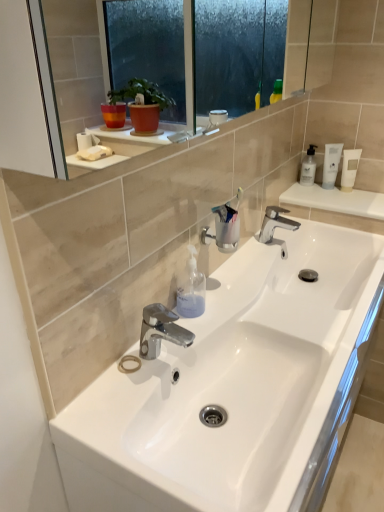
Question: Is clear plastic cup at center next to chrome metallic faucet at center, the second tap in the top-to-bottom sequence?

Choices:
 (A) yes
 (B) no

Answer: (B)

Question: Is clear plastic cup at center positioned beyond the bounds of chrome metallic faucet at center, placed as the first tap when sorted from front to back?

Choices:
 (A) yes
 (B) no

Answer: (A)

Question: Is clear plastic cup at center far from chrome metallic faucet at center, which is counted as the first tap, starting from the bottom?

Choices:
 (A) yes
 (B) no

Answer: (B)

Question: From the image's perspective, is clear plastic cup at center below chrome metallic faucet at center, placed as the first tap when sorted from front to back?

Choices:
 (A) no
 (B) yes

Answer: (A)

Question: Considering the relative positions of clear plastic cup at center and chrome metallic faucet at center, positioned as the 1th tap in left-to-right order, in the image provided, is clear plastic cup at center to the right of chrome metallic faucet at center, positioned as the 1th tap in left-to-right order, from the viewer's perspective?

Choices:
 (A) yes
 (B) no

Answer: (A)

Question: From a real-world perspective, is clear plastic cup at center positioned under chrome metallic faucet at center, the second tap in the top-to-bottom sequence, based on gravity?

Choices:
 (A) yes
 (B) no

Answer: (B)

Question: Is clear plastic cup at center oriented away from white matte bottle at upper right?

Choices:
 (A) yes
 (B) no

Answer: (B)

Question: Does clear plastic cup at center have a lesser height compared to white matte bottle at upper right?

Choices:
 (A) yes
 (B) no

Answer: (B)

Question: From a real-world perspective, does clear plastic cup at center stand above white matte bottle at upper right?

Choices:
 (A) yes
 (B) no

Answer: (A)

Question: From the image's perspective, does clear plastic cup at center appear higher than white matte bottle at upper right?

Choices:
 (A) no
 (B) yes

Answer: (A)

Question: Is clear plastic cup at center touching white matte bottle at upper right?

Choices:
 (A) no
 (B) yes

Answer: (A)

Question: Considering the relative sizes of clear plastic cup at center and white matte bottle at upper right in the image provided, is clear plastic cup at center wider than white matte bottle at upper right?

Choices:
 (A) yes
 (B) no

Answer: (A)

Question: Is white matte tube at upper right outside chrome metallic faucet at center, the 2th tap viewed from the right?

Choices:
 (A) yes
 (B) no

Answer: (A)